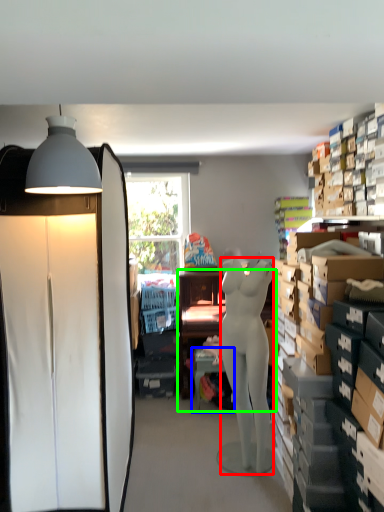
Question: Estimate the real-world distances between objects in this image. Which object is closer to person (highlighted by a red box), table (highlighted by a blue box) or desk (highlighted by a green box)?

Choices:
 (A) table
 (B) desk

Answer: (A)